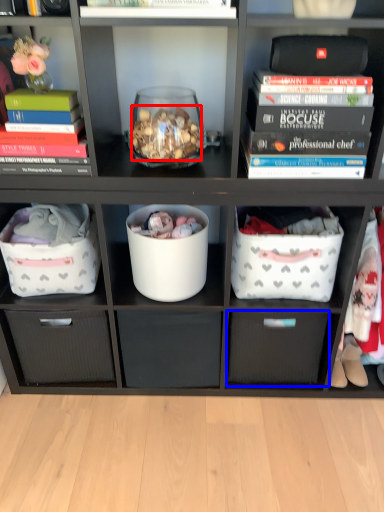
Question: Which object is closer to the camera taking this photo, stuff (highlighted by a red box) or drawer (highlighted by a blue box)?

Choices:
 (A) stuff
 (B) drawer

Answer: (A)